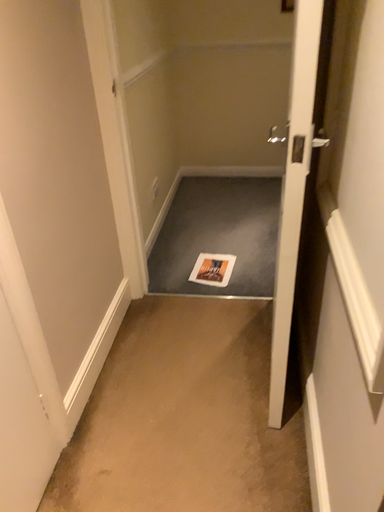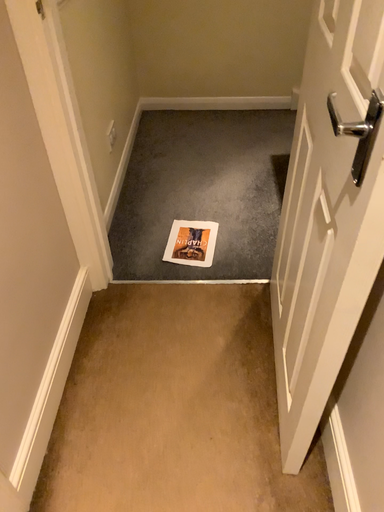
Question: How did the camera likely rotate when shooting the video?

Choices:
 (A) rotated downward
 (B) rotated upward

Answer: (A)